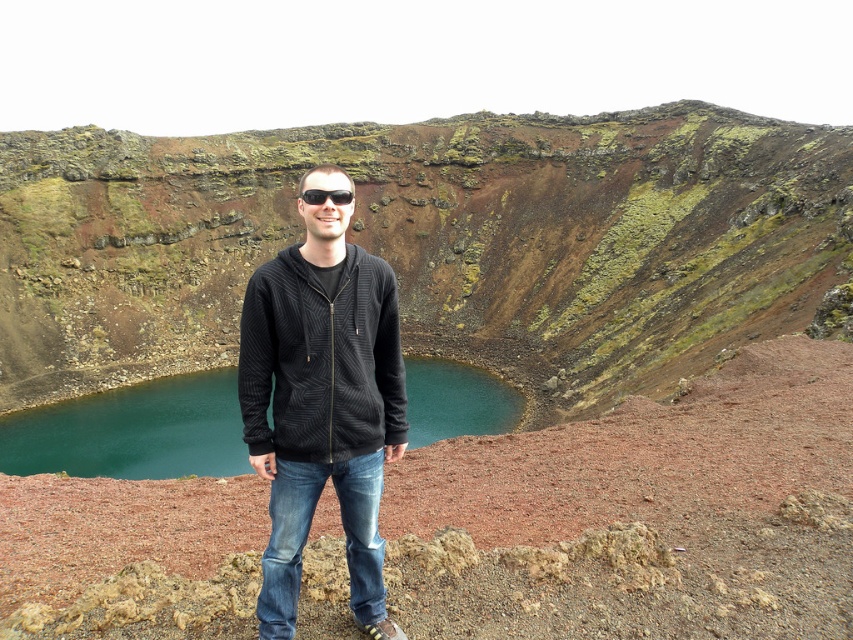
Between black textured hoodie at center and black plastic sunglasses at center, which one is positioned higher?

black plastic sunglasses at center is higher up.

Between black textured hoodie at center and black plastic sunglasses at center, which one has more height?

black textured hoodie at center

Measure the distance between point [349,320] and camera.

Point [349,320] is 85.51 feet from camera.

Find the location of a particular element. The height and width of the screenshot is (640, 853). black textured hoodie at center is located at coordinates (322, 406).

Can you confirm if green mossy rock at center is wider than black textured hoodie at center?

Indeed, green mossy rock at center has a greater width compared to black textured hoodie at center.

Is point (7, 385) closer to camera compared to point (294, 605)?

No, it is not.

Identify the location of green mossy rock at center. The width and height of the screenshot is (853, 640). [x=428, y=243].

Between green mossy rock at center and black textured zip-up hoodie at center, which one has more height?

With more height is green mossy rock at center.

Can you confirm if green mossy rock at center is shorter than black textured zip-up hoodie at center?

Incorrect, green mossy rock at center's height does not fall short of black textured zip-up hoodie at center's.

Which is in front, point (24, 182) or point (329, 310)?

Point (329, 310) is in front.

Locate an element on the screen. The image size is (853, 640). green mossy rock at center is located at coordinates (428, 243).